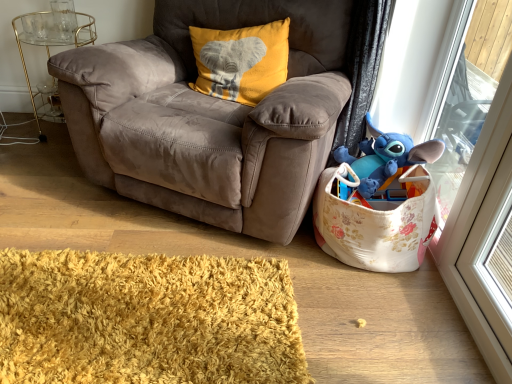
Find the location of a particular element. The width and height of the screenshot is (512, 384). free point below yellow shaggy rug at lower left (from a real-world perspective) is located at coordinates (155, 310).